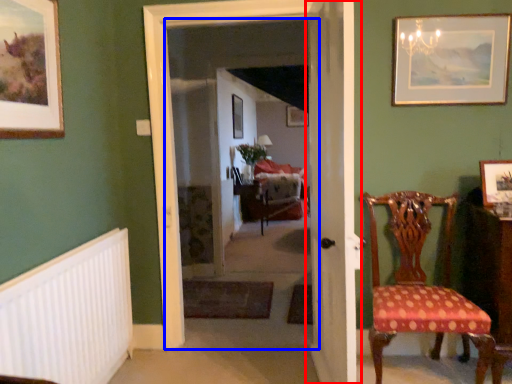
Question: Which object is further to the camera taking this photo, door (highlighted by a red box) or corridor (highlighted by a blue box)?

Choices:
 (A) door
 (B) corridor

Answer: (B)